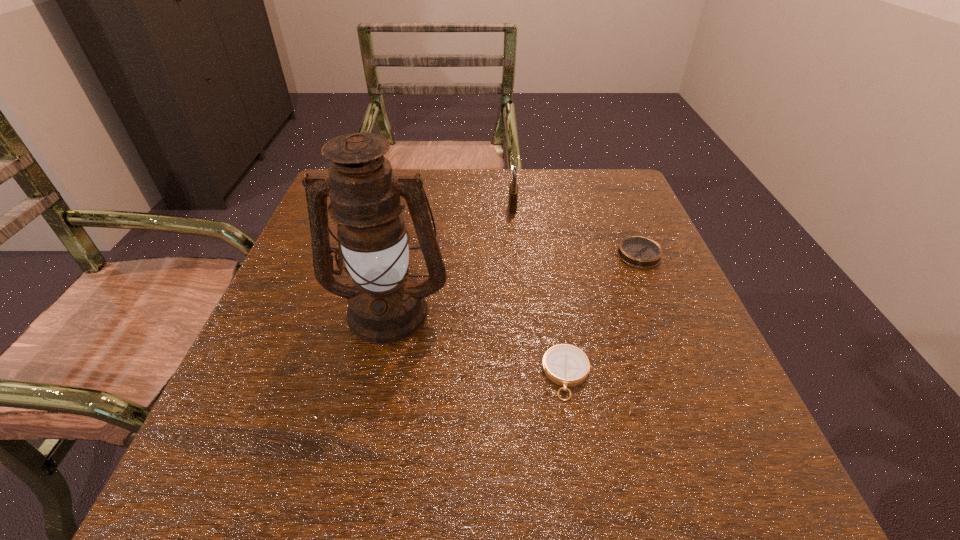
You are a GUI agent. You are given a task and a screenshot of the screen. Output one action in this format:
    pyautogui.click(x=<x>, y=<y>)
    Task: Click on the tallest object
    The image size is (960, 540).
    Given the screenshot: What is the action you would take?
    click(x=386, y=305)

Locate an element on the screen. the leftmost object is located at coordinates (386, 305).

Locate an element on the screen. padlock is located at coordinates (513, 189).

Image resolution: width=960 pixels, height=540 pixels. I want to click on the third shortest object, so click(x=513, y=189).

Where is `the third nearest object`? This screenshot has width=960, height=540. the third nearest object is located at coordinates click(638, 251).

Locate an element on the screen. The image size is (960, 540). the rightmost object is located at coordinates (638, 251).

At what (x,y) coordinates should I click in order to perform the action: click on the third object from left to right. Please return your answer as a coordinate pair (x, y). Image resolution: width=960 pixels, height=540 pixels. Looking at the image, I should click on (566, 365).

You are a GUI agent. You are given a task and a screenshot of the screen. Output one action in this format:
    pyautogui.click(x=<x>, y=<y>)
    Task: Click on the left compass
    This screenshot has width=960, height=540.
    Given the screenshot: What is the action you would take?
    pyautogui.click(x=566, y=365)

Where is `vacant region located 0.060m on the left of the third farthest object`? Image resolution: width=960 pixels, height=540 pixels. vacant region located 0.060m on the left of the third farthest object is located at coordinates (298, 310).

Where is `free space located 0.150m on the right of the padlock`? The width and height of the screenshot is (960, 540). free space located 0.150m on the right of the padlock is located at coordinates (578, 207).